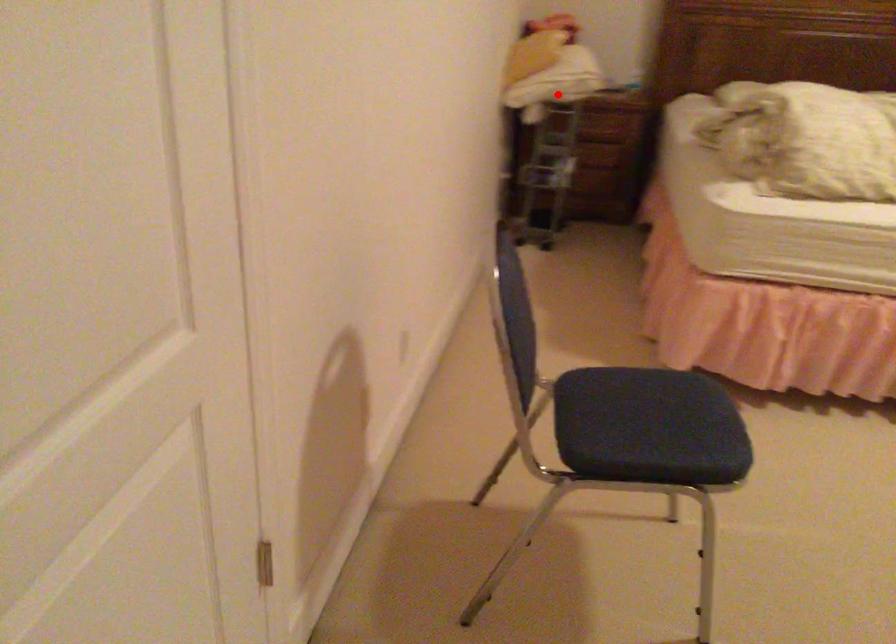
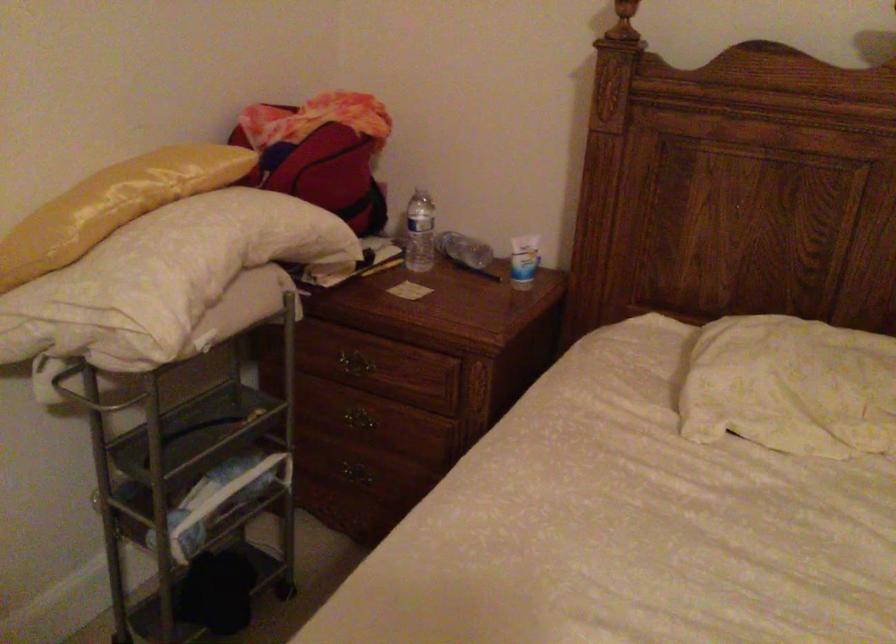
Question: I am providing you with two images of the same scene from different viewpoints. In image1, a red point is highlighted. Considering the same 3D point in image2, which of the following is correct?

Choices:
 (A) It is closer
 (B) It is farther

Answer: (A)